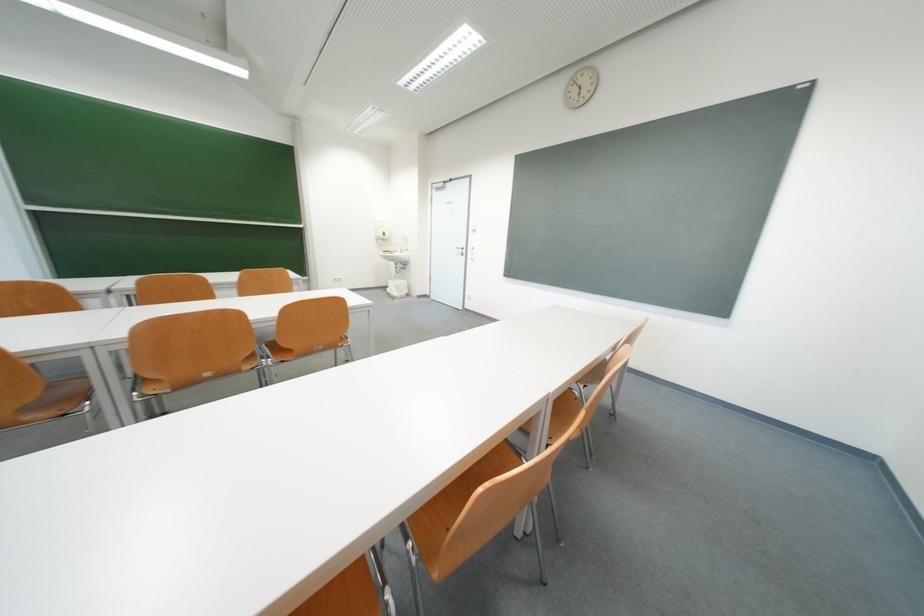
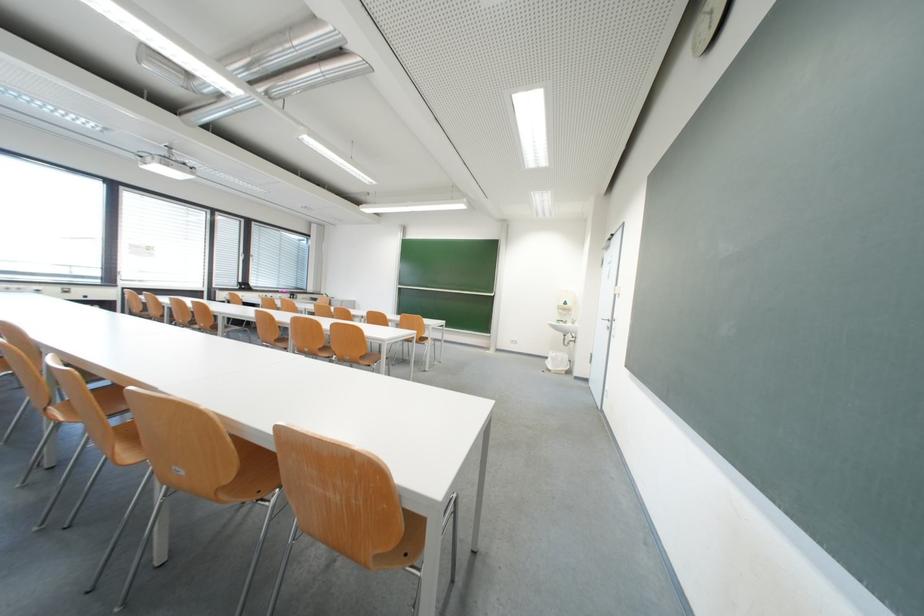
Find the pixel in the second image that matches (396,256) in the first image.

(570, 326)